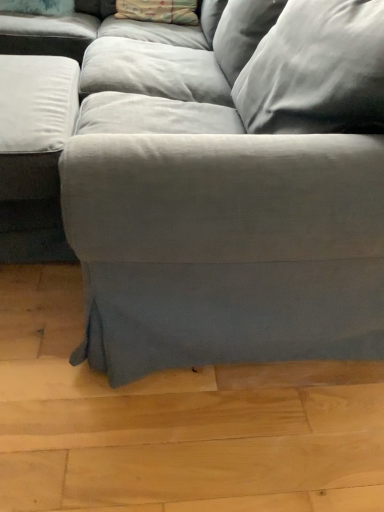
Question: Considering the positions of patterned fabric pillow at upper center, which appears as the first pillow when viewed from the right, and fluffy white pillow at upper left, the 1th pillow positioned from the left, in the image, is patterned fabric pillow at upper center, which appears as the first pillow when viewed from the right, wider or thinner than fluffy white pillow at upper left, the 1th pillow positioned from the left,?

Choices:
 (A) thin
 (B) wide

Answer: (B)

Question: From a real-world perspective, relative to fluffy white pillow at upper left, the 1th pillow positioned from the left, is patterned fabric pillow at upper center, the second pillow from the left, vertically above or below?

Choices:
 (A) above
 (B) below

Answer: (A)

Question: Is patterned fabric pillow at upper center, which appears as the first pillow when viewed from the right, taller or shorter than fluffy white pillow at upper left, the 1th pillow positioned from the left?

Choices:
 (A) tall
 (B) short

Answer: (A)

Question: Choose the correct answer: Is fluffy white pillow at upper left, which ranks as the 2th pillow in right-to-left order, inside patterned fabric pillow at upper center, the second pillow from the left, or outside it?

Choices:
 (A) outside
 (B) inside

Answer: (A)

Question: Would you say fluffy white pillow at upper left, which ranks as the 2th pillow in right-to-left order, is to the left or to the right of patterned fabric pillow at upper center, which appears as the first pillow when viewed from the right, in the picture?

Choices:
 (A) left
 (B) right

Answer: (A)

Question: From a real-world perspective, is fluffy white pillow at upper left, the 1th pillow positioned from the left, physically located above or below patterned fabric pillow at upper center, the second pillow from the left?

Choices:
 (A) above
 (B) below

Answer: (B)

Question: From their relative heights in the image, would you say fluffy white pillow at upper left, the 1th pillow positioned from the left, is taller or shorter than patterned fabric pillow at upper center, the second pillow from the left?

Choices:
 (A) short
 (B) tall

Answer: (A)